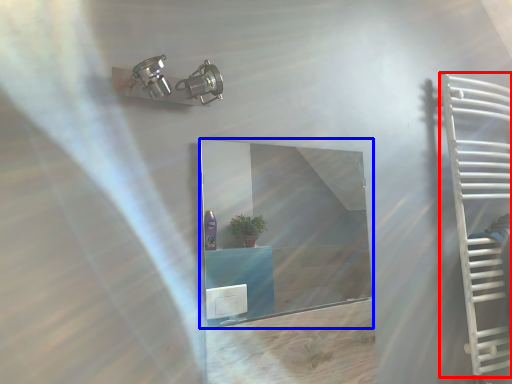
Question: Which object is further to the camera taking this photo, ladder (highlighted by a red box) or mirror (highlighted by a blue box)?

Choices:
 (A) ladder
 (B) mirror

Answer: (A)